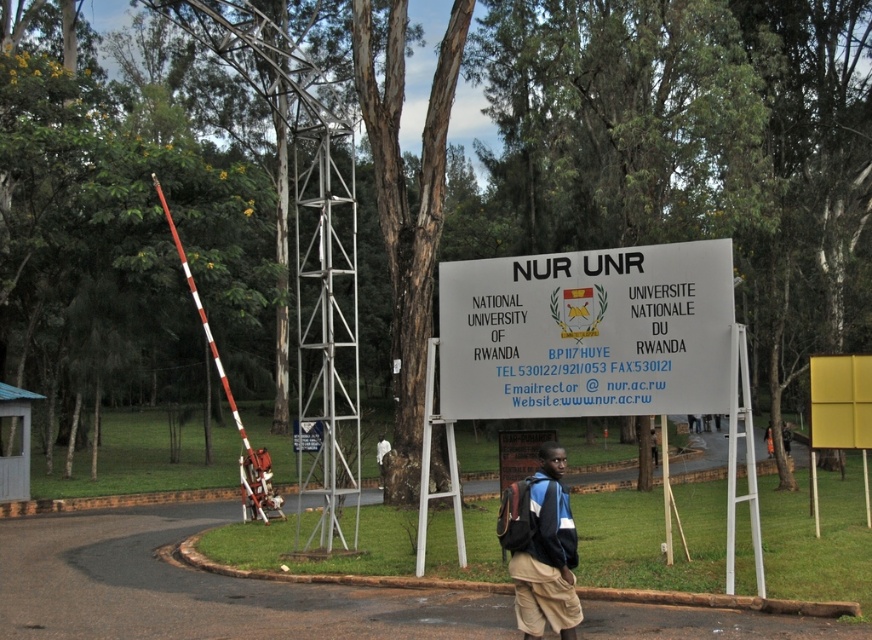
How distant is white paper sign at center from khaki shorts at center?

The distance of white paper sign at center from khaki shorts at center is 12.11 feet.

Between point (499, 376) and point (542, 568), which one is positioned behind?

Point (499, 376)

Does point (545, 292) lie behind point (556, 557)?

Yes, it is.

Image resolution: width=872 pixels, height=640 pixels. Identify the location of white paper sign at center. (587, 332).

Is khaki shorts at center positioned at the back of yellow matte sign at center?

No, it is in front of yellow matte sign at center.

Can you confirm if khaki shorts at center is shorter than yellow matte sign at center?

No.

The height and width of the screenshot is (640, 872). Identify the location of khaki shorts at center. (547, 554).

Is white paper sign at center to the left of yellow matte sign at center from the viewer's perspective?

Indeed, white paper sign at center is positioned on the left side of yellow matte sign at center.

Is white paper sign at center to the right of yellow matte sign at center from the viewer's perspective?

No, white paper sign at center is not to the right of yellow matte sign at center.

Is point (555, 275) positioned after point (852, 356)?

That is False.

Identify the location of white paper sign at center. (587, 332).